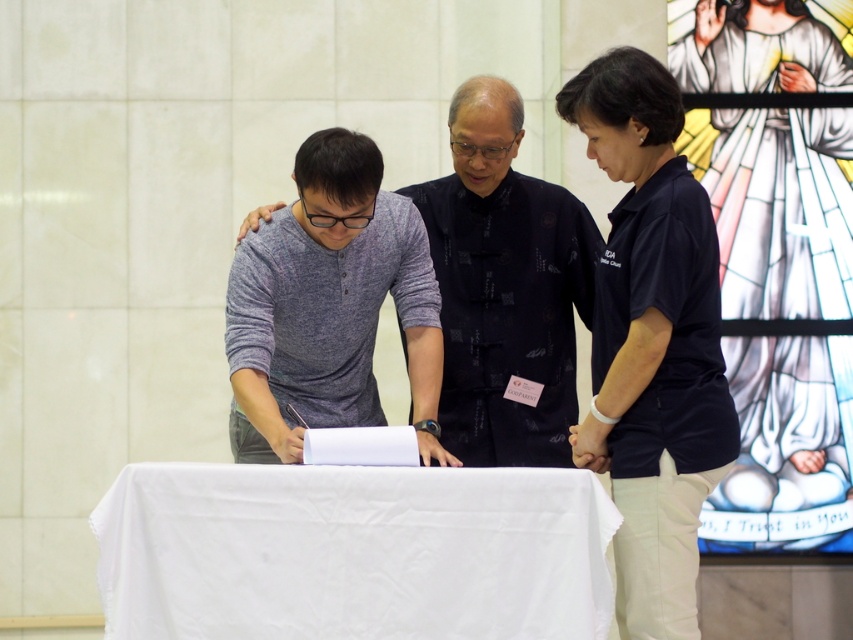
You are standing in the room and see the point at coordinates (352, 552). What object is located at that point?

The point at coordinates (352, 552) indicates the white cloth covered table at center.

You are a photographer trying to capture a group photo of the dark blue shirt at center and gray cotton shirt at center. Since you want both shirts to appear the same size in the photo, where should you position yourself relative to them?

To make the dark blue shirt at center and gray cotton shirt at center appear the same size in the photo, you should position yourself closer to the gray cotton shirt at center, which is larger, so that its size in the photo matches the smaller dark blue shirt at center.